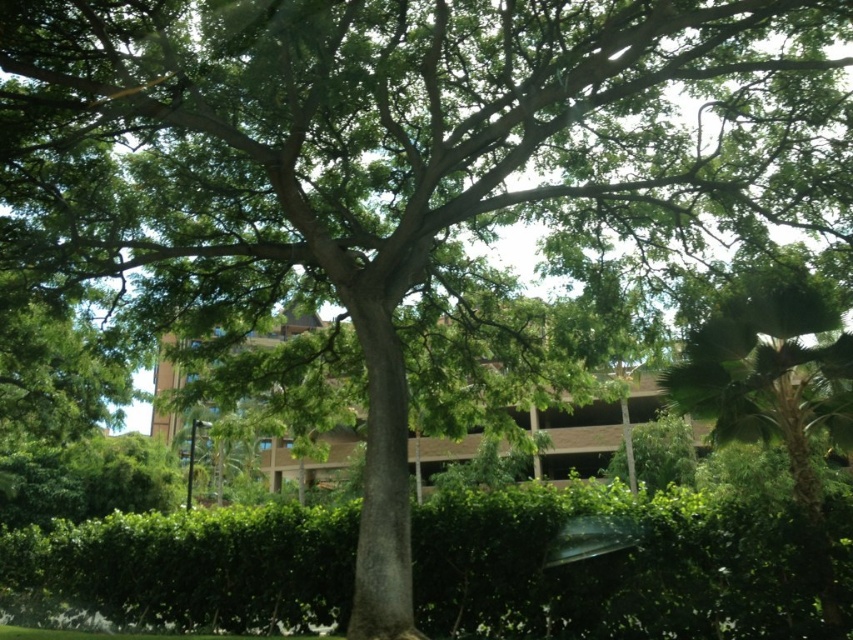
Does point (344, 531) come behind point (770, 291)?

Yes, point (344, 531) is farther from viewer.

Is green leafy hedge at center smaller than green leafy palm at right?

Actually, green leafy hedge at center might be larger than green leafy palm at right.

Identify the location of green leafy hedge at center. (612, 566).

Locate an element on the screen. green leafy hedge at center is located at coordinates (612, 566).